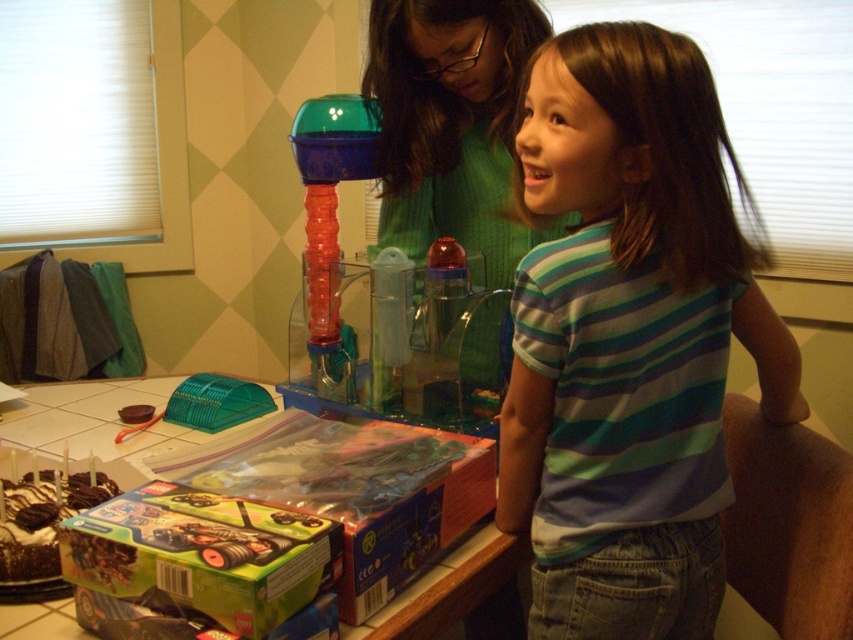
You are standing in front of the table at the birthday celebration. Where is the striped cotton shirt at center located in relation to the other items on the table?

The striped cotton shirt at center is located at the coordinates point [628,339].

You are a guest at the birthday party and want to take a photo of both the striped cotton shirt at center and the green knitted sweater at upper center. Which one should you focus on first to ensure both are in the frame?

The striped cotton shirt at center is positioned on the right side of green knitted sweater at upper center, so you should focus on the green knitted sweater at upper center first to ensure both are in the frame.

You are at a birthday party and need to choose a gift for the birthday person. You have two options on the table, a striped cotton shirt at center and a green knitted sweater at upper center. Which one is bigger in size?

The striped cotton shirt at center is larger in size compared to the green knitted sweater at upper center.